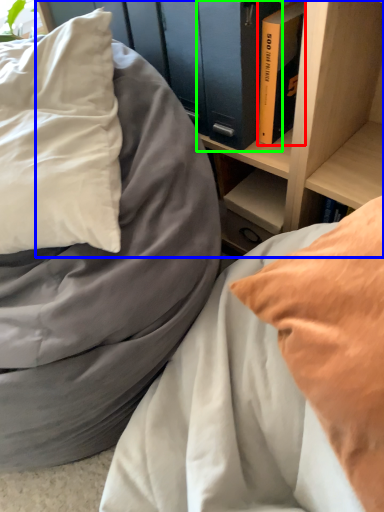
Question: Based on their relative distances, which object is farther from book (highlighted by a red box)? Choose from shelf (highlighted by a blue box) and paperback book (highlighted by a green box).

Choices:
 (A) shelf
 (B) paperback book

Answer: (A)